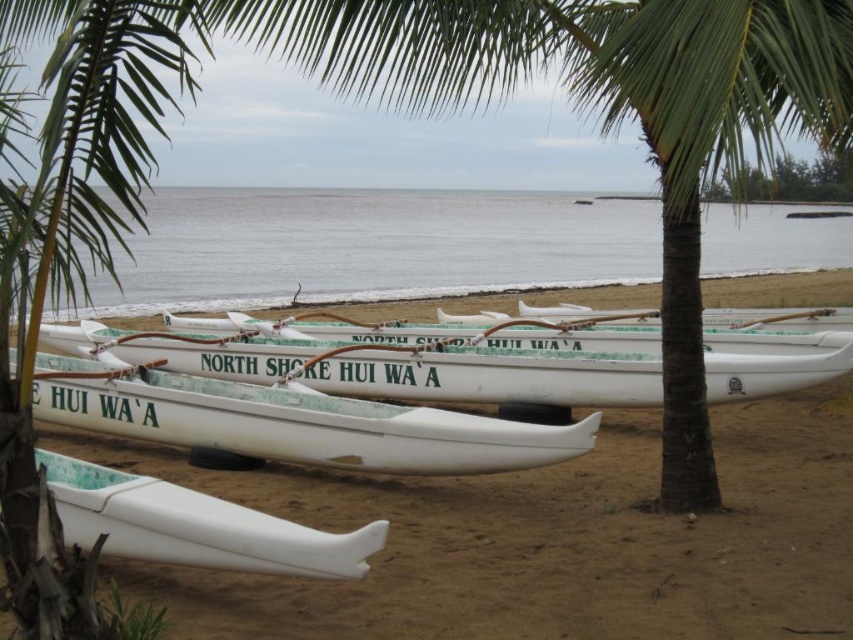
Question: Which point is closer to the camera?

Choices:
 (A) (357, 268)
 (B) (238, 342)
 (C) (178, 528)

Answer: (C)

Question: Estimate the real-world distances between objects in this image. Which object is closer to the clear water at center?

Choices:
 (A) white glossy canoe at center
 (B) white plastic canoe at center
 (C) white translucent canoe at center

Answer: (A)

Question: Does white glossy canoe at center appear on the right side of white glossy canoe at lower left?

Choices:
 (A) yes
 (B) no

Answer: (B)

Question: Is clear water at center wider than white glossy canoe at center?

Choices:
 (A) yes
 (B) no

Answer: (A)

Question: Does white plastic canoe at center have a smaller size compared to clear water at center?

Choices:
 (A) no
 (B) yes

Answer: (B)

Question: Which point appears closest to the camera in this image?

Choices:
 (A) (297, 458)
 (B) (703, 577)
 (C) (543, 257)

Answer: (B)